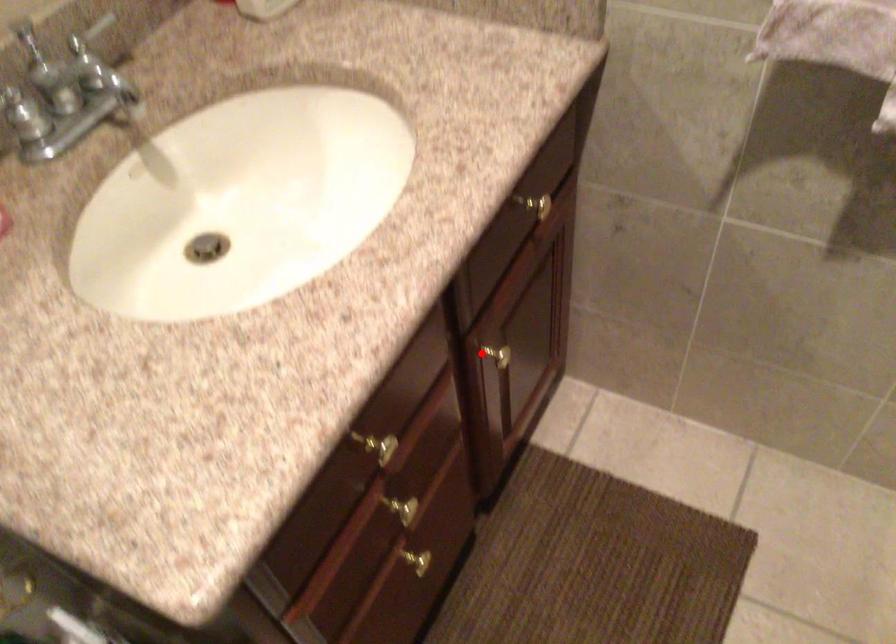
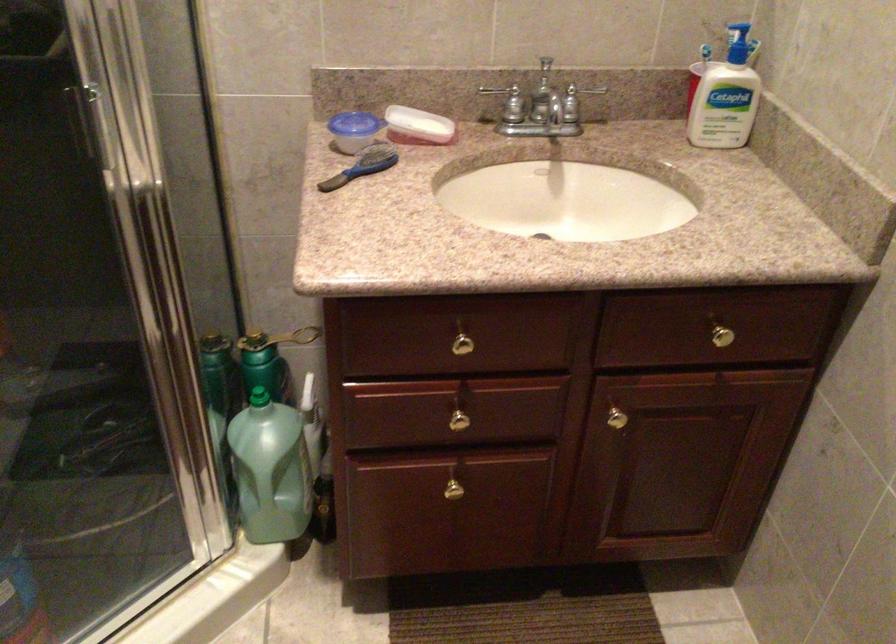
Question: I am providing you with two images of the same scene from different viewpoints. A red point is shown in image1. For the corresponding object point in image2, is it positioned nearer or farther from the camera?

Choices:
 (A) Nearer
 (B) Farther

Answer: (B)